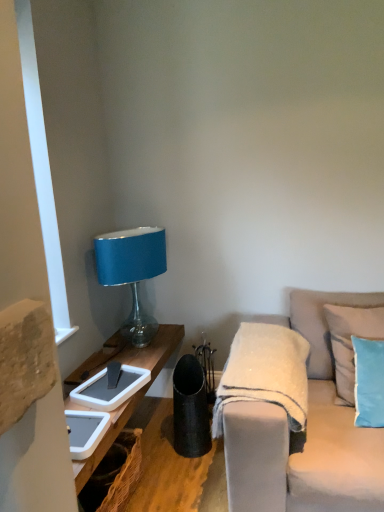
Question: Which is correct: light beige fabric couch at right is inside light blue fabric pillow at right, positioned as the 2th pillow in back-to-front order, or outside of it?

Choices:
 (A) outside
 (B) inside

Answer: (A)

Question: From a real-world perspective, is light beige fabric couch at right above or below light blue fabric pillow at right, the first pillow when ordered from front to back?

Choices:
 (A) below
 (B) above

Answer: (A)

Question: Based on their relative distances, which object is nearer to the light beige fabric couch at right?

Choices:
 (A) light blue fabric pillow at right, positioned as the 2th pillow in back-to-front order
 (B) light blue fabric pillow at right, marked as the first pillow in a back-to-front arrangement
 (C) white fuzzy blanket at center
 (D) matte blue fabric lampshade at upper left

Answer: (C)

Question: Which object is positioned farthest from the matte blue fabric lampshade at upper left?

Choices:
 (A) light beige fabric couch at right
 (B) light blue fabric pillow at right, acting as the second pillow starting from the front
 (C) white fuzzy blanket at center
 (D) light blue fabric pillow at right, positioned as the 2th pillow in back-to-front order

Answer: (D)